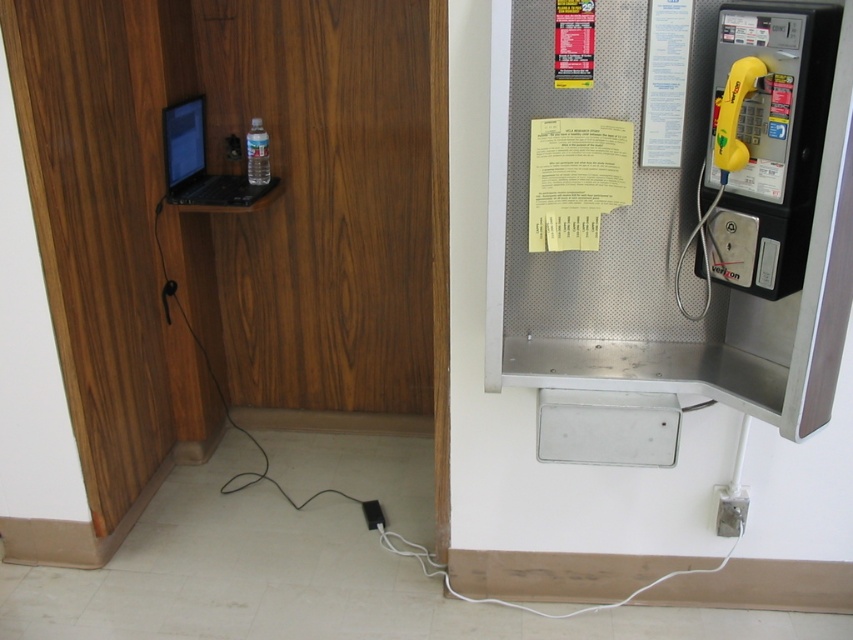
You are a traveler with a laptop needing to charge it. You see a matte black laptop at upper left and a black plastic plug at lower center. Can you reach the plug from your current position at the laptop without moving the laptop or plug?

The distance between the matte black laptop at upper left and the black plastic plug at lower center is 1.25 meters. Since the laptop is connected to a power source via a black cable that extends down to the floor, the cable must be at least 1.25 meters long to reach the plug. Therefore, you can reach the plug without moving either the laptop or the plug.

You are trying to make a call using the yellow plastic payphone at right while your laptop is on the matte black laptop at upper left. Can you reach the payphone without moving the laptop?

The yellow plastic payphone at right is located below the matte black laptop at upper left, so you can likely reach it without moving the laptop as long as there is enough space between them.

You are trying to make a call using the yellow plastic payphone at right. However, you notice a black plastic plug at lower center nearby. Is the payphone closer to you than the plug?

The yellow plastic payphone at right is in front of the black plastic plug at lower center, so yes, the payphone is closer to you than the plug.